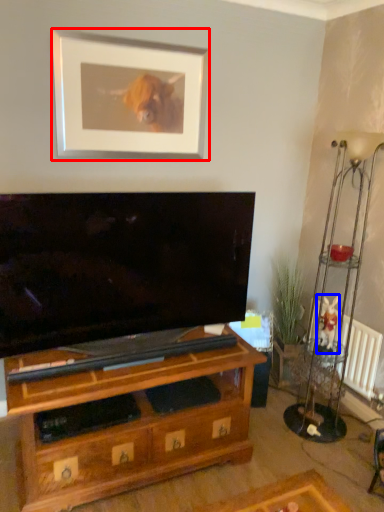
Question: Which object is further to the camera taking this photo, picture frame (highlighted by a red box) or animal (highlighted by a blue box)?

Choices:
 (A) picture frame
 (B) animal

Answer: (B)